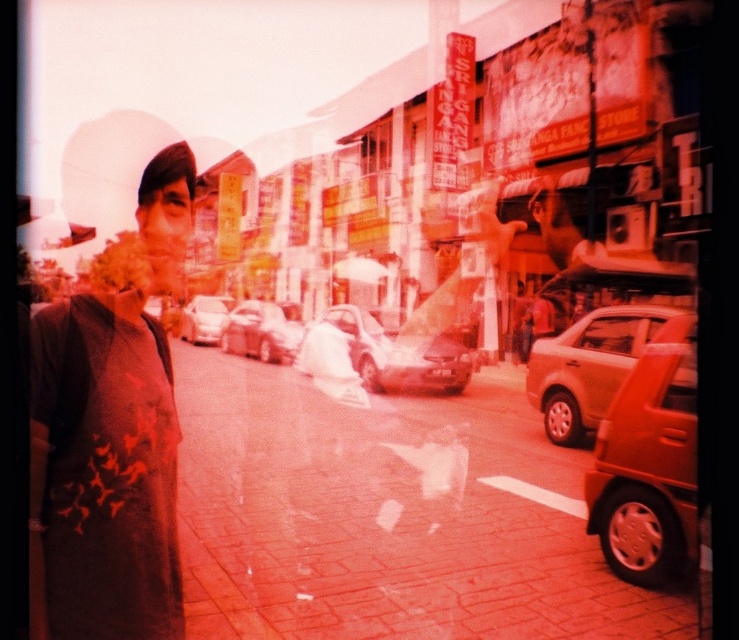
In the urban street scene with a red hue, there is a person on the left and a point marked at coordinates (262, 330). What object is located at that point?

The point at coordinates (262, 330) marks the location of the shiny silver car at center.

You are a photographer trying to capture a clear shot of two specific points in this urban scene. The first point is at coordinates point (x=123, y=627) and the second is at point (x=234, y=320). Given that you want to focus on the point that is closer to you, which coordinate should you adjust your camera settings to prioritize?

Point (x=123, y=627) is closer to the viewer than point (x=234, y=320), so you should adjust your camera settings to prioritize focusing on point (x=123, y=627).

You are a photographer trying to capture a clear shot of the shiny silver car at center and the dark gray textured shirt at left. Based on the scene description, which object is positioned lower in the frame?

The dark gray textured shirt at left is positioned below the shiny silver car at center, so it is lower in the frame.